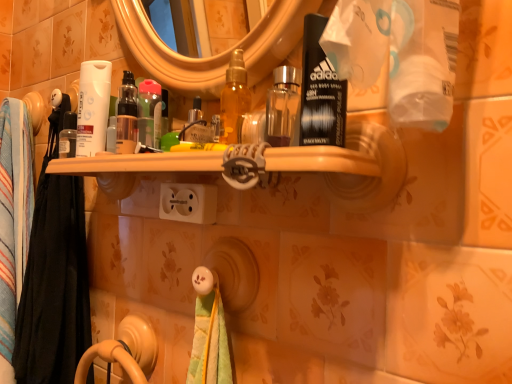
Question: Is translucent plastic bottle at center looking in the opposite direction of white plastic outlet at center?

Choices:
 (A) no
 (B) yes

Answer: (A)

Question: Can you confirm if translucent plastic bottle at center is smaller than white plastic outlet at center?

Choices:
 (A) no
 (B) yes

Answer: (B)

Question: From a real-world perspective, is translucent plastic bottle at center on white plastic outlet at center?

Choices:
 (A) yes
 (B) no

Answer: (A)

Question: Is translucent plastic bottle at center not inside white plastic outlet at center?

Choices:
 (A) yes
 (B) no

Answer: (A)

Question: Is translucent plastic bottle at center wider than white plastic outlet at center?

Choices:
 (A) yes
 (B) no

Answer: (B)

Question: Considering the positions of multicolored fabric towel at left, which ranks as the 2th bath towel in back-to-front order, and white matte tube at left in the image, is multicolored fabric towel at left, which ranks as the 2th bath towel in back-to-front order, bigger or smaller than white matte tube at left?

Choices:
 (A) big
 (B) small

Answer: (A)

Question: From a real-world perspective, is multicolored fabric towel at left, which ranks as the 2th bath towel in back-to-front order, positioned above or below white matte tube at left?

Choices:
 (A) above
 (B) below

Answer: (B)

Question: Considering the relative positions of multicolored fabric towel at left, which ranks as the 2th bath towel in back-to-front order, and white matte tube at left in the image provided, is multicolored fabric towel at left, which ranks as the 2th bath towel in back-to-front order, to the left or to the right of white matte tube at left?

Choices:
 (A) left
 (B) right

Answer: (A)

Question: Is point (14, 357) closer or farther from the camera than point (87, 155)?

Choices:
 (A) closer
 (B) farther

Answer: (B)

Question: Considering the positions of white plastic outlet at center and white matte tube at left in the image, is white plastic outlet at center bigger or smaller than white matte tube at left?

Choices:
 (A) small
 (B) big

Answer: (A)

Question: From a real-world perspective, is white plastic outlet at center physically located above or below white matte tube at left?

Choices:
 (A) above
 (B) below

Answer: (B)

Question: Relative to white matte tube at left, is white plastic outlet at center in front or behind?

Choices:
 (A) behind
 (B) front

Answer: (B)

Question: Is point (216, 203) positioned closer to the camera than point (96, 150)?

Choices:
 (A) farther
 (B) closer

Answer: (B)

Question: Is multicolored fabric towel at left, the first bath towel when ordered from front to back, taller or shorter than translucent plastic bottle at center?

Choices:
 (A) short
 (B) tall

Answer: (B)

Question: Considering the positions of point (31, 266) and point (147, 82), is point (31, 266) closer or farther from the camera than point (147, 82)?

Choices:
 (A) farther
 (B) closer

Answer: (A)